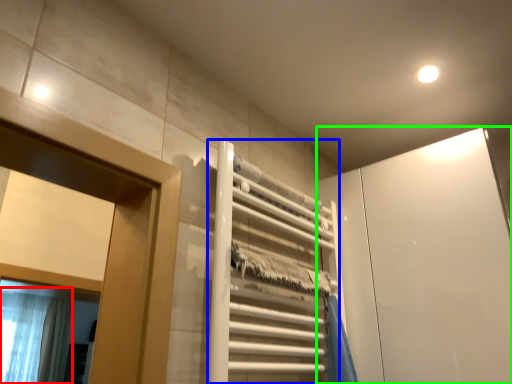
Question: Which object is positioned closest to shower curtain (highlighted by a red box)? Select from elevator (highlighted by a blue box) and screen door (highlighted by a green box).

Choices:
 (A) elevator
 (B) screen door

Answer: (A)